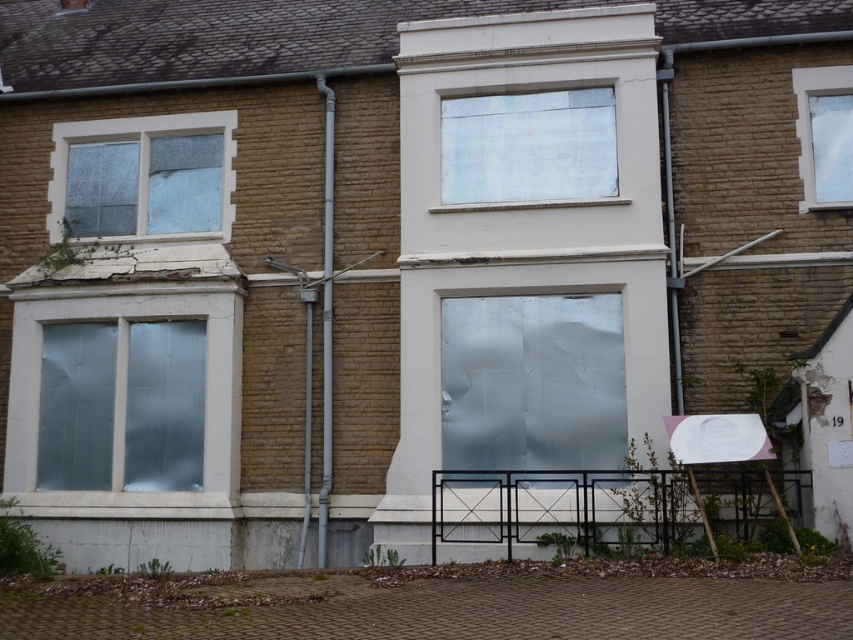
You are an architect inspecting the building. You notice the frosted glass window at center and the clear glass window at upper right. Which window has a larger surface area?

The frosted glass window at center has a larger surface area than the clear glass window at upper right.

You are standing 10 meters away from a two story building with a brick facade. You want to reach a specific point on the building at coordinates point (155, 301). How much further do you need to walk forward to reach that point?

The distance of point (155, 301) from viewer is 15.89 meters. Since you are currently 10 meters away from the building, you need to walk an additional 5.89 meters forward to reach the point.

You are standing at the base of the building and want to reach the frosted glass window at center. The ladder you have can extend up to 12 meters. Is your ladder long enough to reach the window?

The distance between you and the frosted glass window at center is 14.07 meters, which is greater than the ladder length of 12 meters. Therefore, the ladder is not long enough to reach the window.